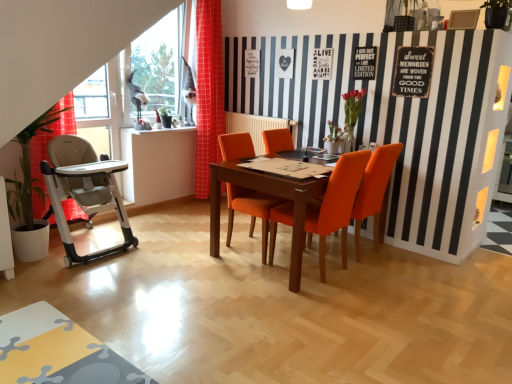
What are the coordinates of `free spot in front of orange fabric chair at center, which ranks as the 2th chair in right-to-left order` in the screenshot? It's located at (327, 298).